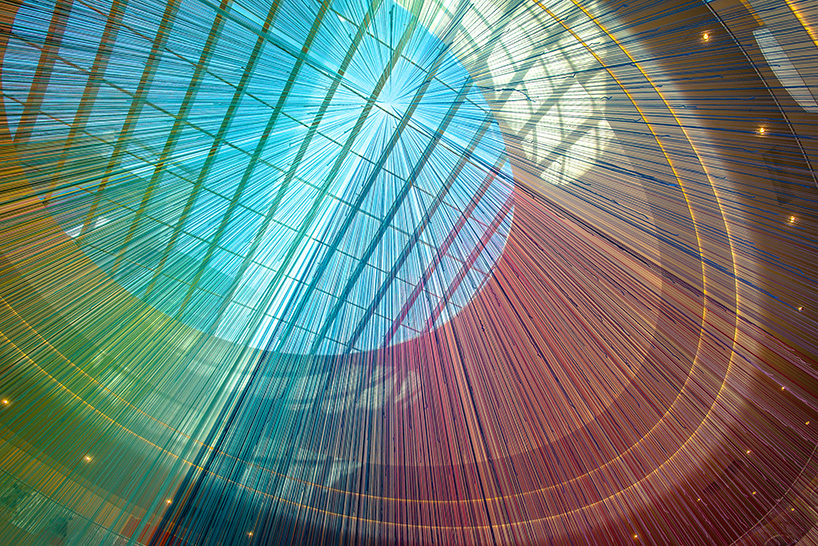
Find the location of a particular element. lights is located at coordinates (770, 134).